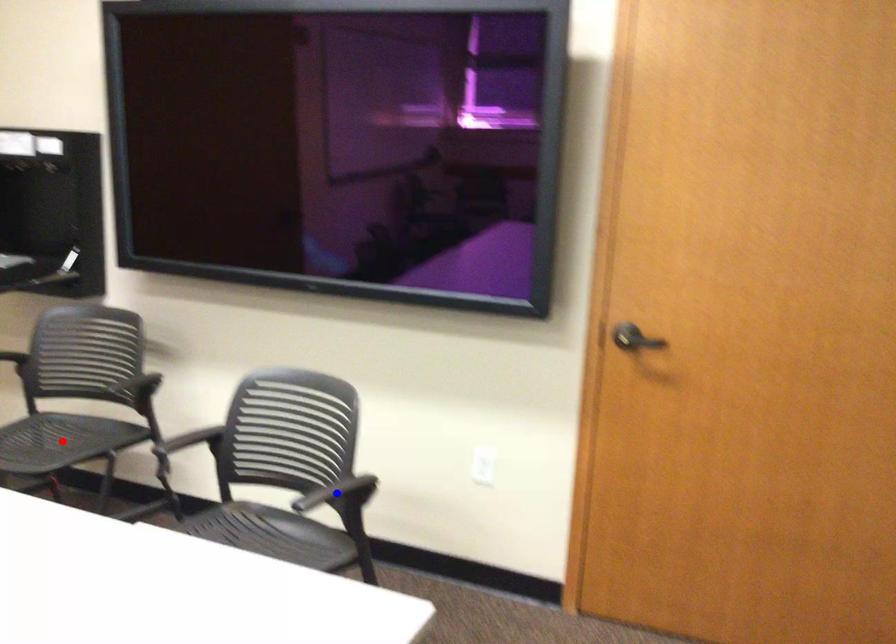
Question: In the image, two points are highlighted. Which point is nearer to the camera? Reply with the corresponding letter.

Choices:
 (A) blue point
 (B) red point

Answer: (A)